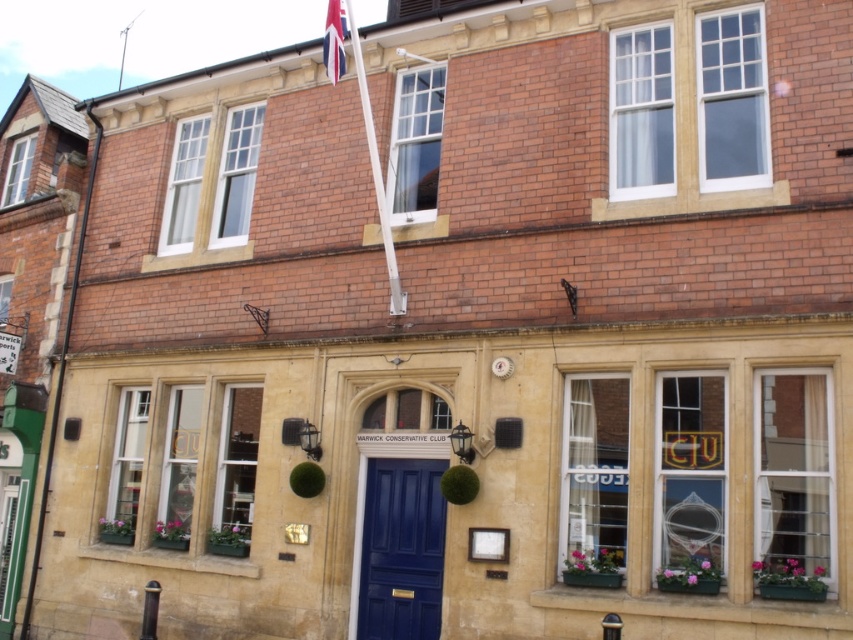
Between point (416, 630) and point (329, 13), which one is positioned behind?

The point (416, 630) is behind.

Which is behind, point (366, 632) or point (339, 1)?

Point (366, 632)

I want to click on shiny blue door at center, so click(x=401, y=548).